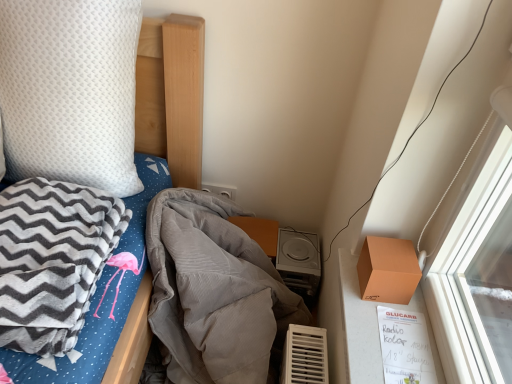
Question: Is white textured pillow at upper left smaller than white plastic power plugs and sockets at upper center?

Choices:
 (A) no
 (B) yes

Answer: (A)

Question: Considering the relative positions of white textured pillow at upper left and white plastic power plugs and sockets at upper center in the image provided, is white textured pillow at upper left to the right of white plastic power plugs and sockets at upper center from the viewer's perspective?

Choices:
 (A) no
 (B) yes

Answer: (A)

Question: Is white textured pillow at upper left aimed at white plastic power plugs and sockets at upper center?

Choices:
 (A) yes
 (B) no

Answer: (B)

Question: Is white textured pillow at upper left outside white plastic power plugs and sockets at upper center?

Choices:
 (A) no
 (B) yes

Answer: (B)

Question: Is white textured pillow at upper left at the left side of white plastic power plugs and sockets at upper center?

Choices:
 (A) no
 (B) yes

Answer: (B)

Question: From a real-world perspective, is orange matte box at right above or below gray corduroy blanket at center, marked as the first blanket in a right-to-left arrangement?

Choices:
 (A) above
 (B) below

Answer: (A)

Question: Is orange matte box at right taller or shorter than gray corduroy blanket at center, marked as the first blanket in a right-to-left arrangement?

Choices:
 (A) tall
 (B) short

Answer: (B)

Question: In terms of size, does orange matte box at right appear bigger or smaller than gray corduroy blanket at center, marked as the first blanket in a right-to-left arrangement?

Choices:
 (A) big
 (B) small

Answer: (B)

Question: Considering the relative positions of orange matte box at right and gray corduroy blanket at center, marked as the second blanket in a left-to-right arrangement, in the image provided, is orange matte box at right to the left or to the right of gray corduroy blanket at center, marked as the second blanket in a left-to-right arrangement,?

Choices:
 (A) left
 (B) right

Answer: (B)

Question: Considering the positions of gray corduroy blanket at center, marked as the second blanket in a left-to-right arrangement, and white textured pillow at upper left in the image, is gray corduroy blanket at center, marked as the second blanket in a left-to-right arrangement, wider or thinner than white textured pillow at upper left?

Choices:
 (A) wide
 (B) thin

Answer: (A)

Question: From their relative heights in the image, would you say gray corduroy blanket at center, marked as the second blanket in a left-to-right arrangement, is taller or shorter than white textured pillow at upper left?

Choices:
 (A) short
 (B) tall

Answer: (B)

Question: Looking at the image, does gray corduroy blanket at center, marked as the first blanket in a right-to-left arrangement, seem bigger or smaller compared to white textured pillow at upper left?

Choices:
 (A) big
 (B) small

Answer: (A)

Question: From the image's perspective, is gray corduroy blanket at center, marked as the second blanket in a left-to-right arrangement, located above or below white textured pillow at upper left?

Choices:
 (A) above
 (B) below

Answer: (B)

Question: From a real-world perspective, is white textured pillow at upper left positioned above or below gray fleece blanket at left, the 1th blanket when ordered from left to right?

Choices:
 (A) above
 (B) below

Answer: (A)

Question: Considering the positions of white textured pillow at upper left and gray fleece blanket at left, the second blanket in the right-to-left sequence, in the image, is white textured pillow at upper left taller or shorter than gray fleece blanket at left, the second blanket in the right-to-left sequence,?

Choices:
 (A) short
 (B) tall

Answer: (B)